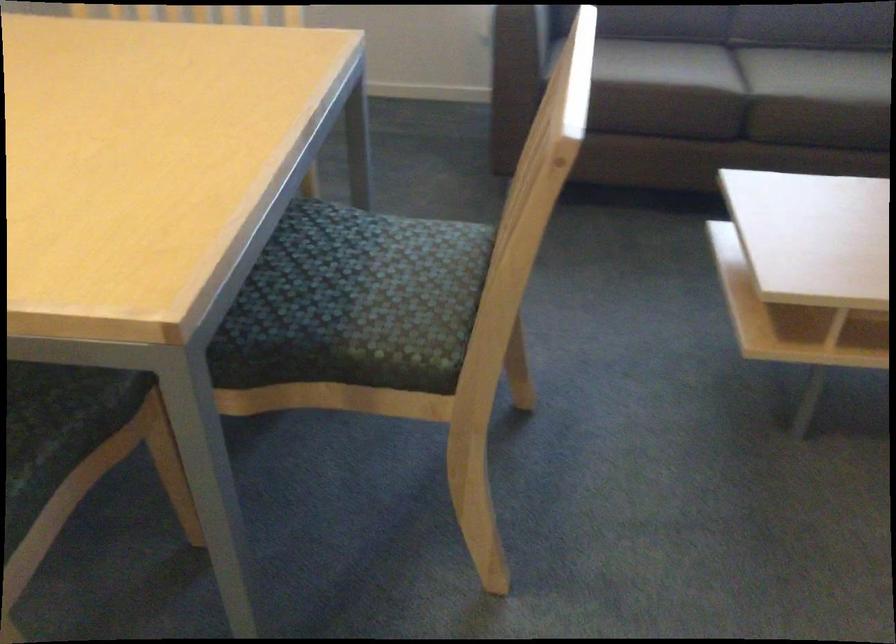
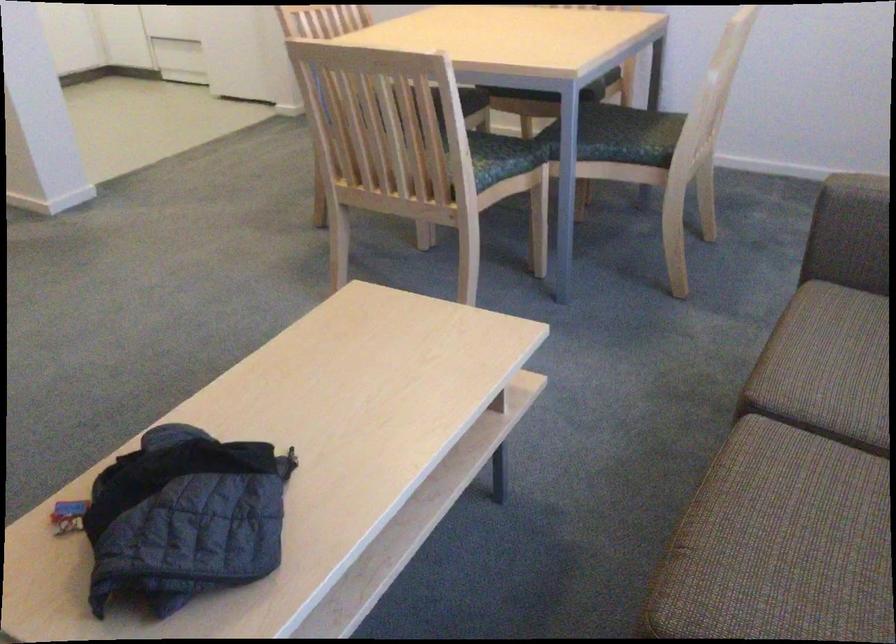
Where in the second image is the point corresponding to (352,225) from the first image?

(501, 158)